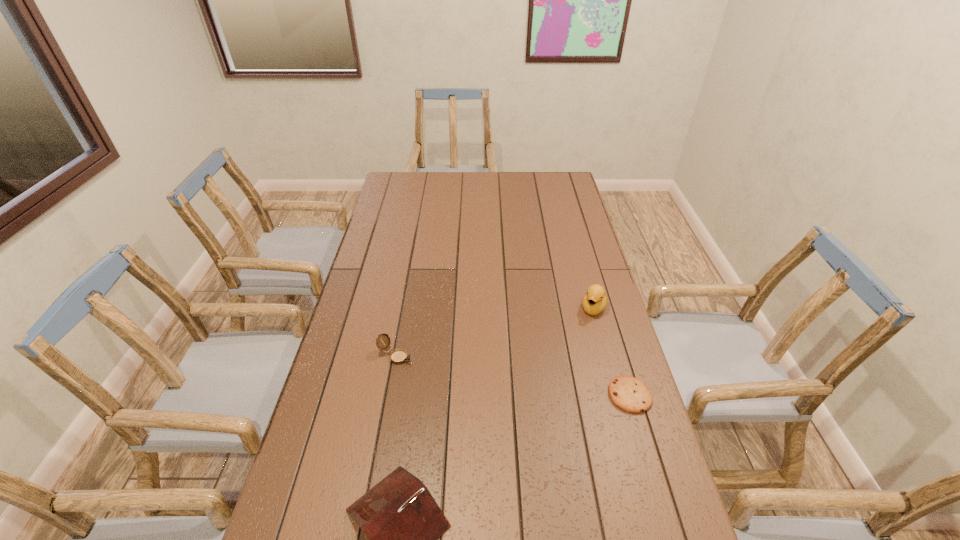
Where is `vacant space on the desktop that is between the book and the shortest object and is positioned facing forward on the tallest object`? The width and height of the screenshot is (960, 540). vacant space on the desktop that is between the book and the shortest object and is positioned facing forward on the tallest object is located at coordinates (521, 453).

This screenshot has width=960, height=540. In order to click on vacant spot on the desktop that is between the nearest object and the third farthest object and is positioned on the face of the second farthest object in this screenshot , I will do `click(552, 437)`.